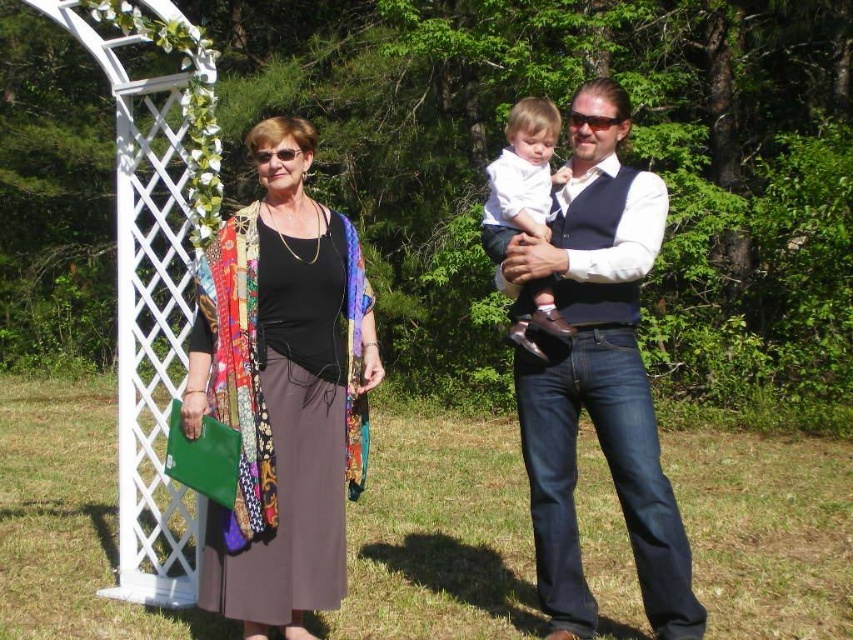
Consider the image. You are a photographer setting up a tripod to take a group photo of the matte white shirt at center and the white soft fabric baby at center. Which subject should you focus on first if you want to ensure both are in focus, considering their heights?

The matte white shirt at center is much taller than the white soft fabric baby at center, so you should focus on the taller subject first to ensure depth of field covers both.

You are planning to place the multicolored fabric shawl at left and the white soft fabric baby at center on a shelf. Which object should you place first to ensure both fit on the shelf without overlapping?

The multicolored fabric shawl at left might be wider than the white soft fabric baby at center, so you should place the wider one first to ensure both fit without overlapping.

You are standing at the center of the image and want to move towards the point marked at coordinates (283, 392). Which direction should you go?

The point at (283, 392) is located on the multicolored fabric shawl at left, so you should move towards the left side of the image to reach it.